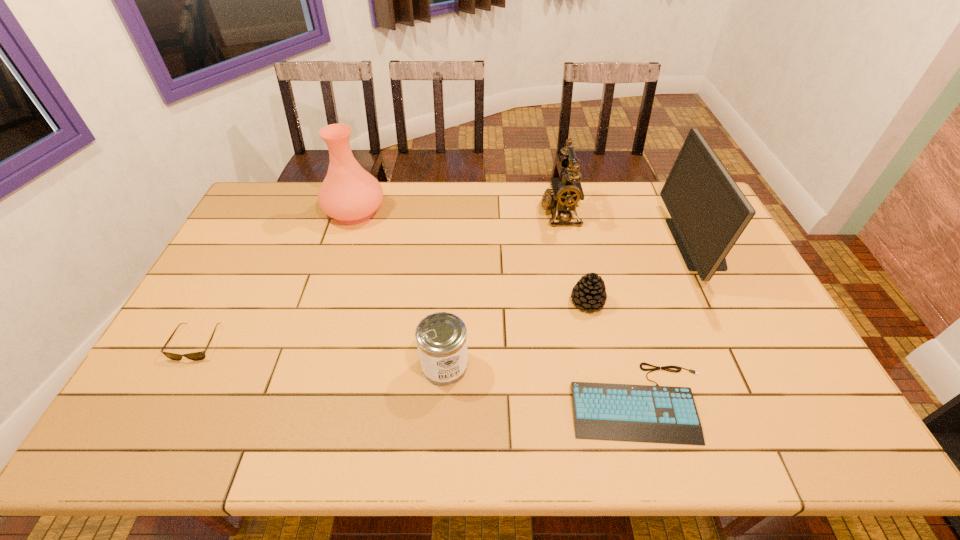
Image resolution: width=960 pixels, height=540 pixels. What are the coordinates of `object that stands as the second closest to the telephone` in the screenshot? It's located at (709, 212).

Find the location of a particular element. Image resolution: width=960 pixels, height=540 pixels. vacant region that satisfies the following two spatial constraints: 1. on the screen side of the rightmost object; 2. on the lenses of the leftmost object is located at coordinates 749,343.

The height and width of the screenshot is (540, 960). Identify the location of free point that satisfies the following two spatial constraints: 1. on the front side of the vase; 2. on the right side of the shortest object. (294, 401).

The image size is (960, 540). Find the location of `vacant point that satisfies the following two spatial constraints: 1. on the back side of the shortest object; 2. on the rotary dial of the telephone`. vacant point that satisfies the following two spatial constraints: 1. on the back side of the shortest object; 2. on the rotary dial of the telephone is located at coordinates (588, 213).

What are the coordinates of `free space that satisfies the following two spatial constraints: 1. on the lenses of the leftmost object; 2. on the right side of the can` in the screenshot? It's located at tap(184, 366).